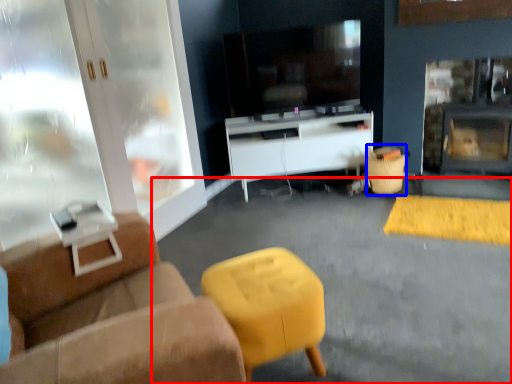
Question: Which of the following is the farthest to the observer, concrete (highlighted by a red box) or bar stool (highlighted by a blue box)?

Choices:
 (A) concrete
 (B) bar stool

Answer: (B)